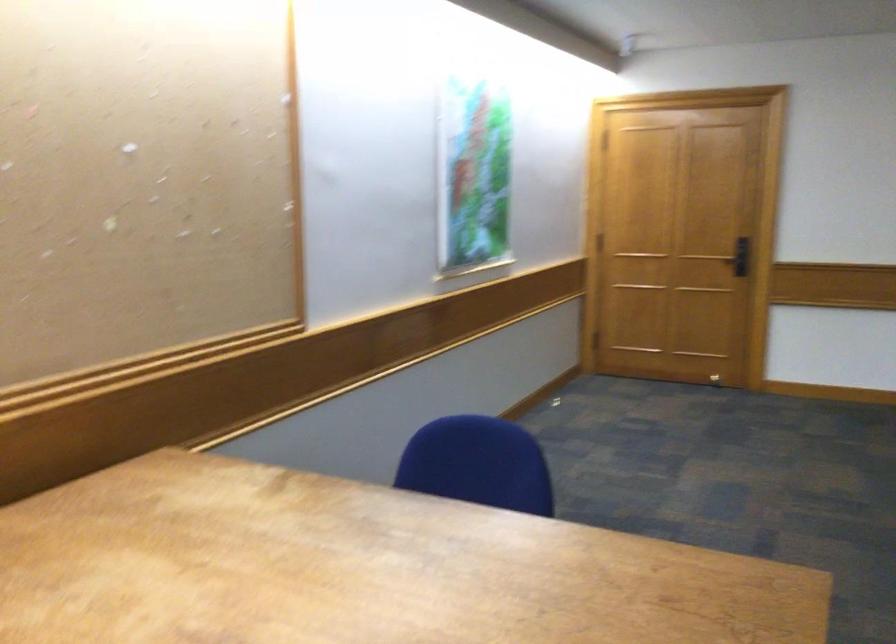
Locate an element on the screen. The image size is (896, 644). black door handle is located at coordinates (739, 257).